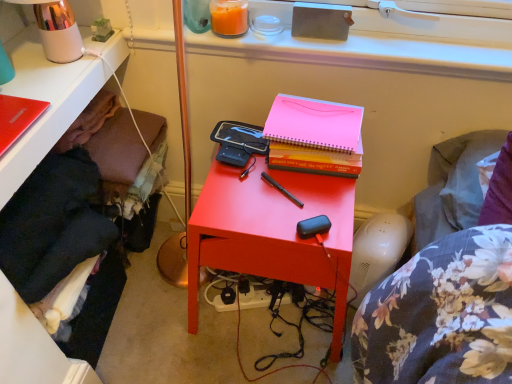
Question: Is matte red nightstand at center next to matte red notebook at upper left and touching it?

Choices:
 (A) yes
 (B) no

Answer: (B)

Question: Is matte red nightstand at center thinner than matte red notebook at upper left?

Choices:
 (A) no
 (B) yes

Answer: (A)

Question: From the image's perspective, is matte red nightstand at center on matte red notebook at upper left?

Choices:
 (A) yes
 (B) no

Answer: (B)

Question: Is matte red nightstand at center bigger than matte red notebook at upper left?

Choices:
 (A) no
 (B) yes

Answer: (B)

Question: From the image's perspective, does matte red nightstand at center appear lower than matte red notebook at upper left?

Choices:
 (A) no
 (B) yes

Answer: (B)

Question: From the image's perspective, is black fabric at lower left positioned above or below matte red notebook at upper left?

Choices:
 (A) above
 (B) below

Answer: (B)

Question: In the image, is black fabric at lower left positioned in front of or behind matte red notebook at upper left?

Choices:
 (A) behind
 (B) front

Answer: (A)

Question: Would you say black fabric at lower left is inside or outside matte red notebook at upper left?

Choices:
 (A) inside
 (B) outside

Answer: (B)

Question: Considering the positions of point (32, 140) and point (6, 104), is point (32, 140) closer or farther from the camera than point (6, 104)?

Choices:
 (A) farther
 (B) closer

Answer: (B)

Question: From the image's perspective, is orange wax candle at upper center above or below metallic pink table lamp at upper left?

Choices:
 (A) above
 (B) below

Answer: (A)

Question: Based on their sizes in the image, would you say orange wax candle at upper center is bigger or smaller than metallic pink table lamp at upper left?

Choices:
 (A) big
 (B) small

Answer: (B)

Question: From a real-world perspective, is orange wax candle at upper center positioned above or below metallic pink table lamp at upper left?

Choices:
 (A) above
 (B) below

Answer: (B)

Question: Is orange wax candle at upper center in front of or behind metallic pink table lamp at upper left in the image?

Choices:
 (A) behind
 (B) front

Answer: (A)

Question: From the image's perspective, is orange wax candle at upper center above or below matte red notebook at upper left?

Choices:
 (A) below
 (B) above

Answer: (B)

Question: Considering the positions of orange wax candle at upper center and matte red notebook at upper left in the image, is orange wax candle at upper center bigger or smaller than matte red notebook at upper left?

Choices:
 (A) big
 (B) small

Answer: (B)